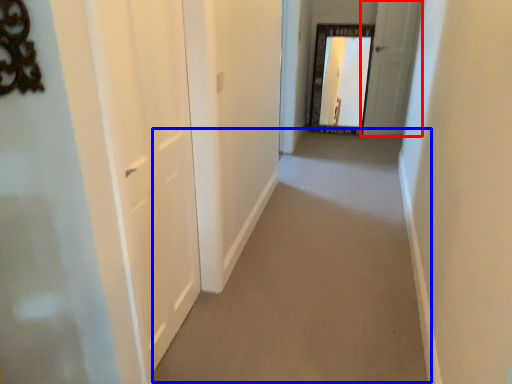
Question: Which point is further to the camera, door (highlighted by a red box) or path (highlighted by a blue box)?

Choices:
 (A) door
 (B) path

Answer: (A)